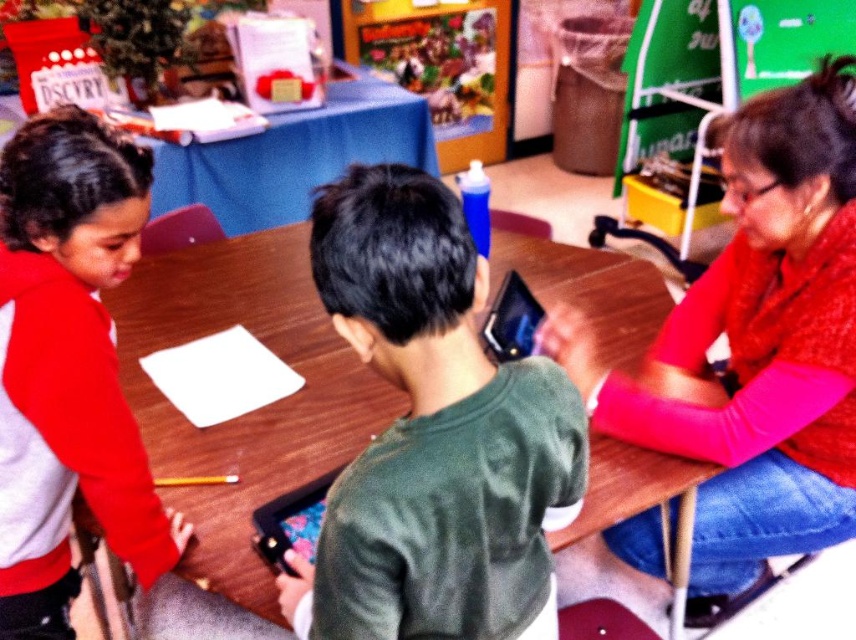
Question: Which object is farther from the camera taking this photo?

Choices:
 (A) green matte shirt at center
 (B) red sweater at right
 (C) wooden poster at center
 (D) red fleece jacket at left

Answer: (C)

Question: From the image, what is the correct spatial relationship of wooden table at center in relation to wooden poster at center?

Choices:
 (A) above
 (B) below

Answer: (B)

Question: Can you confirm if red sweater at right is positioned above wooden poster at center?

Choices:
 (A) yes
 (B) no

Answer: (B)

Question: Which point is farther to the camera?

Choices:
 (A) click(420, 136)
 (B) click(491, 26)
 (C) click(9, 182)

Answer: (B)

Question: Does green matte shirt at center have a smaller size compared to wooden poster at center?

Choices:
 (A) yes
 (B) no

Answer: (A)

Question: Which point is closer to the camera?

Choices:
 (A) (759, 180)
 (B) (484, 45)
 (C) (615, 566)
 (D) (409, 428)

Answer: (D)